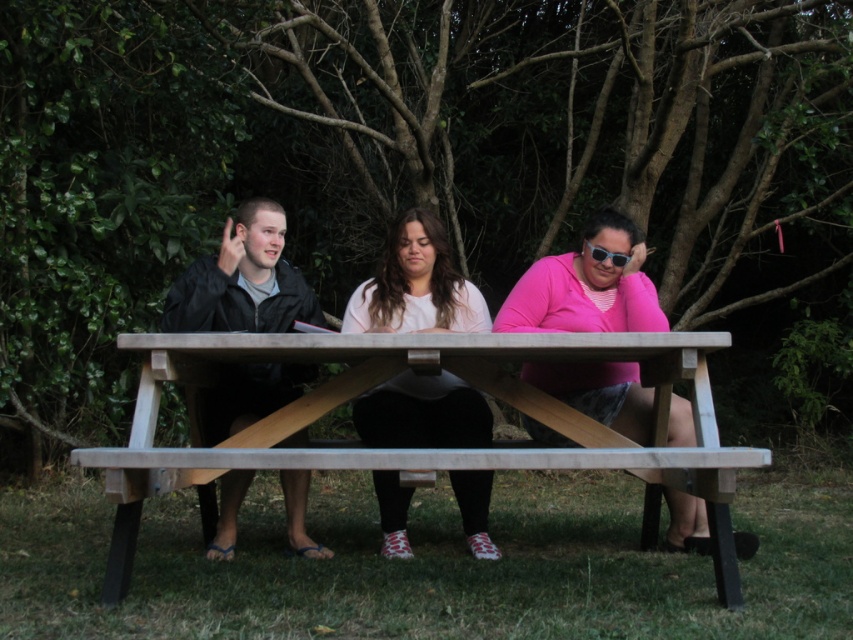
Is pink matte shirt at center above black matte jacket at left?

Incorrect, pink matte shirt at center is not positioned above black matte jacket at left.

What do you see at coordinates (416, 284) in the screenshot? The width and height of the screenshot is (853, 640). I see `pink matte shirt at center` at bounding box center [416, 284].

I want to click on pink matte shirt at center, so click(x=416, y=284).

Looking at this image, how distant is pink matte shirt at center from matte black jacket at left?

pink matte shirt at center is 57.40 centimeters away from matte black jacket at left.

Does pink matte shirt at center have a lesser width compared to matte black jacket at left?

Correct, pink matte shirt at center's width is less than matte black jacket at left's.

Describe the element at coordinates (416, 284) in the screenshot. I see `pink matte shirt at center` at that location.

Identify the location of pink matte shirt at center. The image size is (853, 640). (416, 284).

Does matte black jacket at left have a lesser height compared to sunglasses at center?

No.

Does point (606, 234) lie behind point (596, 250)?

No, (606, 234) is in front of (596, 250).

Consider the image. Who is more forward, (631, 221) or (593, 252)?

Point (593, 252)

Identify the location of matte black jacket at left. This screenshot has width=853, height=640. point(585,285).